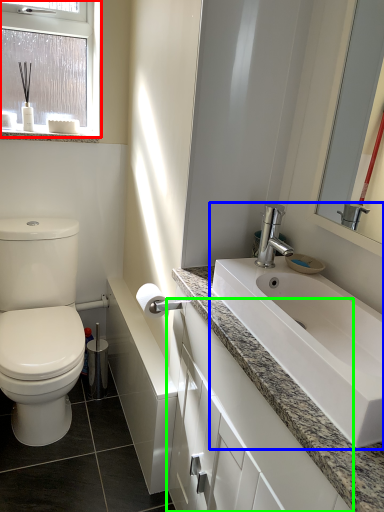
Question: Which is nearer to the window (highlighted by a red box)? sink (highlighted by a blue box) or bathroom cabinet (highlighted by a green box).

Choices:
 (A) sink
 (B) bathroom cabinet

Answer: (A)